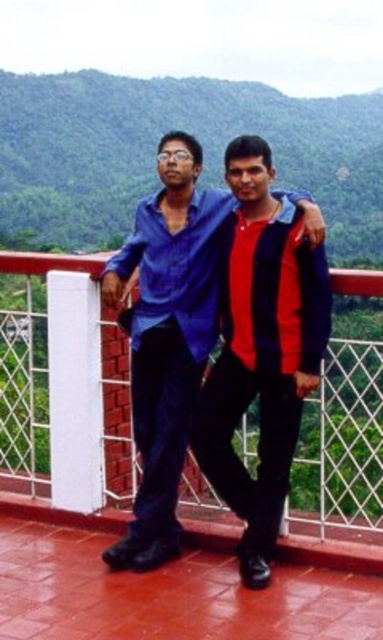
At what (x,y) coordinates should I click in order to perform the action: click on green leafy mountain at upper center. Please return your answer as a coordinate pair (x, y). This screenshot has width=383, height=640. Looking at the image, I should click on (155, 148).

Does green leafy mountain at upper center have a greater width compared to matte blue shirt at center?

Correct, the width of green leafy mountain at upper center exceeds that of matte blue shirt at center.

Between point (301, 179) and point (160, 192), which one is positioned in front?

Point (160, 192)

Find the location of a particular element. This screenshot has width=383, height=640. green leafy mountain at upper center is located at coordinates (155, 148).

Locate an element on the screen. white metal/rail at center is located at coordinates (65, 397).

Is point (1, 324) farther from camera compared to point (166, 474)?

Yes, point (1, 324) is farther from viewer.

The height and width of the screenshot is (640, 383). I want to click on white metal/rail at center, so click(65, 397).

Based on the photo, can you confirm if white metal/rail at center is shorter than green leafy mountain at upper center?

Indeed, white metal/rail at center has a lesser height compared to green leafy mountain at upper center.

Can you confirm if white metal/rail at center is positioned to the right of green leafy mountain at upper center?

Yes, white metal/rail at center is to the right of green leafy mountain at upper center.

This screenshot has height=640, width=383. I want to click on white metal/rail at center, so click(65, 397).